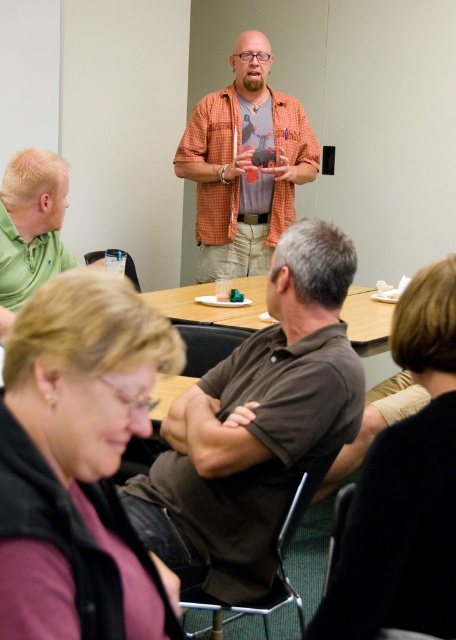
You are a person who is 5 feet tall and wants to walk between the brown cotton shirt at center and the orange checkered shirt at center. Can you fit through the space between them without touching either?

The brown cotton shirt at center and orange checkered shirt at center are 6.33 feet apart, so yes, a person who is 5 feet tall can fit through the space between them without touching either since the distance is greater than the person height.

You are organizing a photo shoot and need to arrange two models wearing the brown cotton shirt at center and orange checkered shirt at center. Based on their heights, which model should stand in front to ensure both are visible in the photo?

The brown cotton shirt at center is shorter than the orange checkered shirt at center, so the model wearing the brown cotton shirt at center should stand in front to ensure both are visible in the photo.